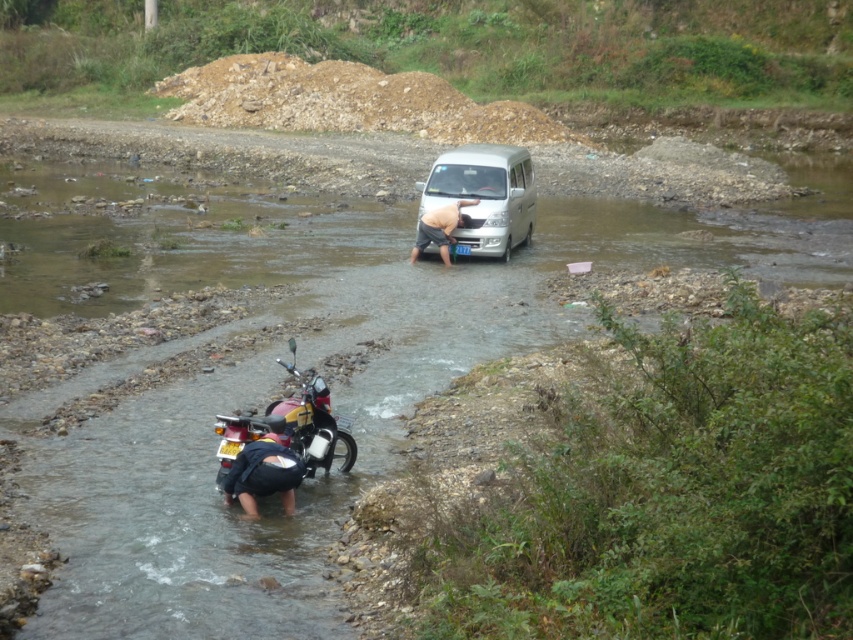
You are standing at the edge of the river and want to cross to the other side. There are two points marked on the left side of the river at coordinates point (248,412) and point (283,460). Which point is closer to you, indicating a shallower part of the river where it might be easier to cross?

Point (248,412) is further to the viewer than point (283,460), so the closer point to you is point (283,460). This might be a shallower part of the river where it is easier to cross.